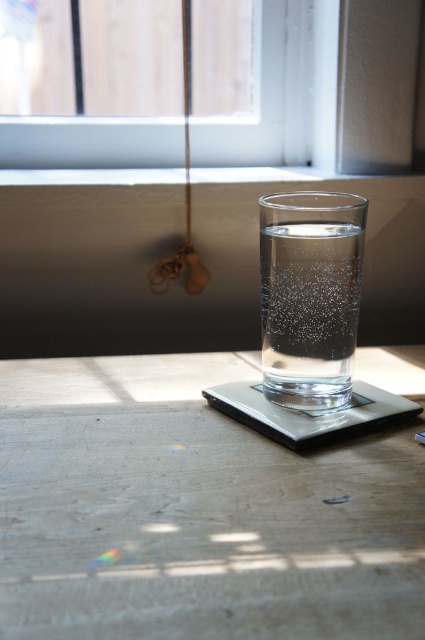
Question: Does transparent glass window at upper center appear under clear glass water at center?

Choices:
 (A) yes
 (B) no

Answer: (B)

Question: Based on their relative distances, which object is farther from the transparent glass table at center?

Choices:
 (A) transparent glass window at upper center
 (B) clear glass water at center

Answer: (A)

Question: Is transparent glass table at center further to the viewer compared to transparent glass window at upper center?

Choices:
 (A) no
 (B) yes

Answer: (A)

Question: Which object appears farthest from the camera in this image?

Choices:
 (A) clear glass water at center
 (B) transparent glass table at center

Answer: (A)

Question: Considering the relative positions of transparent glass window at upper center and clear glass water at center in the image provided, where is transparent glass window at upper center located with respect to clear glass water at center?

Choices:
 (A) right
 (B) left

Answer: (B)

Question: Which object appears closest to the camera in this image?

Choices:
 (A) transparent glass table at center
 (B) transparent glass window at upper center
 (C) clear glass water at center

Answer: (A)